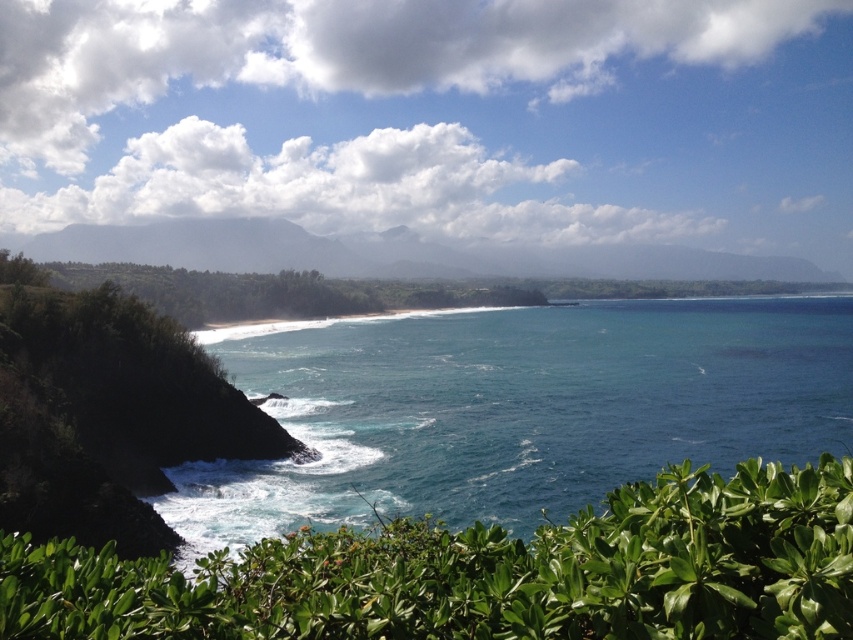
Question: Is blue glossy water at center thinner than green leafy shrub at lower center?

Choices:
 (A) yes
 (B) no

Answer: (B)

Question: Can you confirm if blue glossy water at center is positioned to the left of green leafy shrub at lower center?

Choices:
 (A) no
 (B) yes

Answer: (A)

Question: Which point is farther from the camera taking this photo?

Choices:
 (A) (819, 531)
 (B) (489, 348)

Answer: (B)

Question: Is blue glossy water at center to the right of green leafy shrub at lower center from the viewer's perspective?

Choices:
 (A) no
 (B) yes

Answer: (B)

Question: Which point is farther from the camera taking this photo?

Choices:
 (A) (796, 518)
 (B) (321, 332)

Answer: (B)